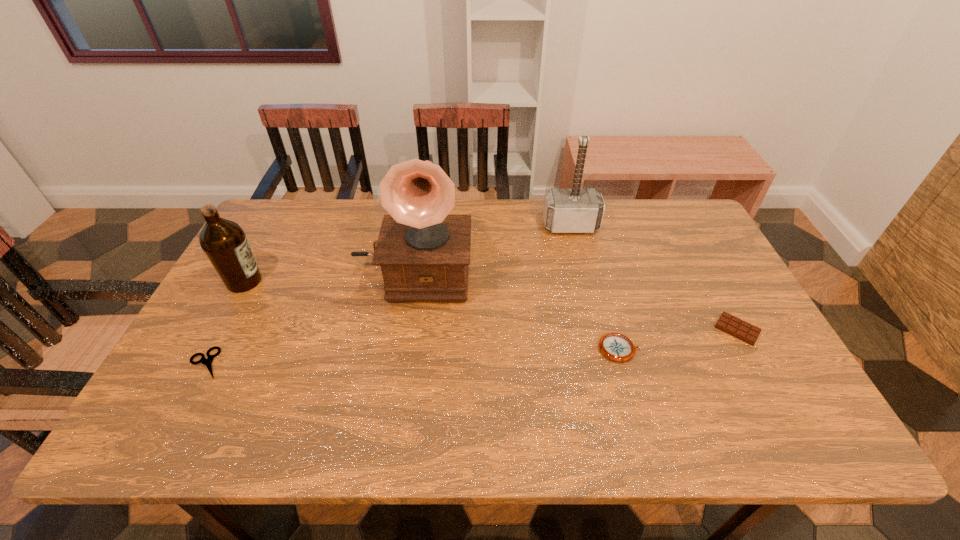
You are a GUI agent. You are given a task and a screenshot of the screen. Output one action in this format:
    pyautogui.click(x=<x>, y=<y>)
    Task: Click on the free space that satisfies the following two spatial constraints: 1. on the label of the fourth shortest object; 2. on the left side of the rightmost object
    This screenshot has width=960, height=540.
    Given the screenshot: What is the action you would take?
    pyautogui.click(x=218, y=329)

The height and width of the screenshot is (540, 960). Identify the location of free spot that satisfies the following two spatial constraints: 1. on the label of the compass; 2. on the left side of the third tallest object. (207, 349).